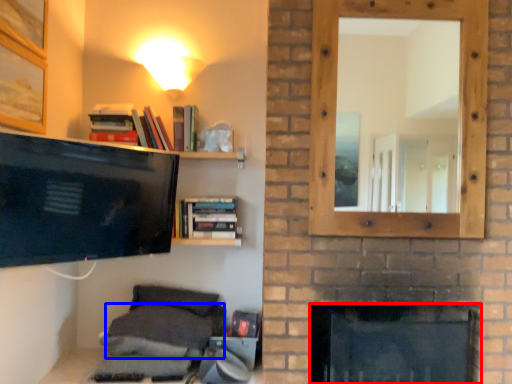
Question: Which object appears closest to the camera in this image, fireplace (highlighted by a red box) or pillow (highlighted by a blue box)?

Choices:
 (A) fireplace
 (B) pillow

Answer: (A)